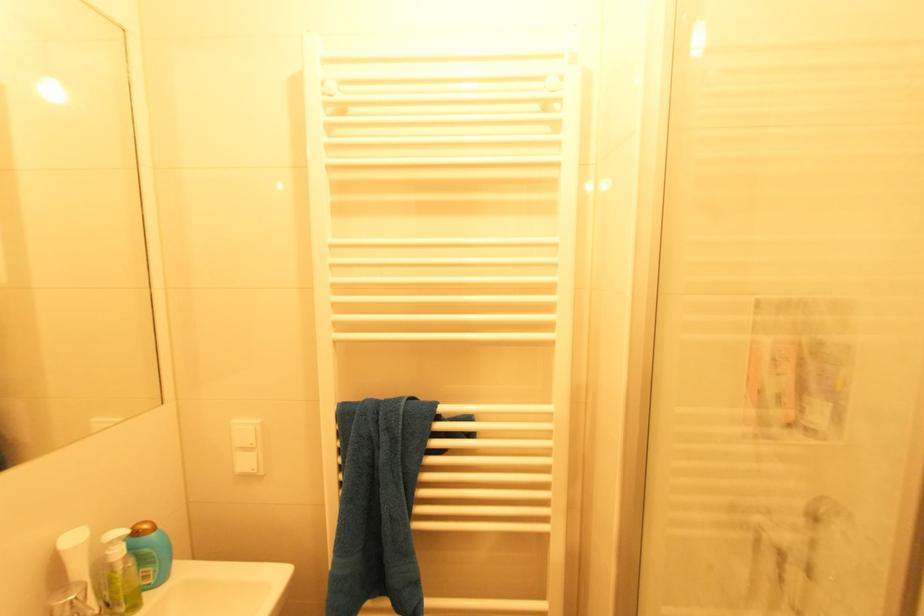
Describe the element at coordinates (245, 451) in the screenshot. Image resolution: width=924 pixels, height=616 pixels. I see `the white light switch` at that location.